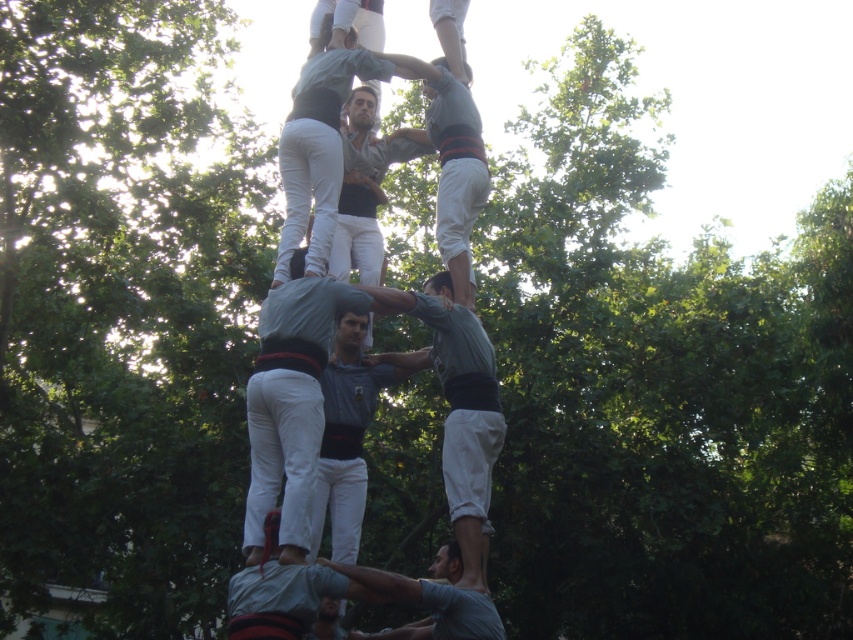
Question: Observing the image, what is the correct spatial positioning of matte gray shirt at center in reference to gray cotton shirt at lower center?

Choices:
 (A) left
 (B) right

Answer: (B)

Question: Which point is farther to the camera?

Choices:
 (A) matte gray shirt at center
 (B) gray cotton shirt at lower center

Answer: (A)

Question: In this image, where is matte gray shirt at center located relative to gray cotton shirt at lower center?

Choices:
 (A) right
 (B) left

Answer: (A)

Question: Is matte gray shirt at center above gray cotton shirt at lower center?

Choices:
 (A) yes
 (B) no

Answer: (A)

Question: Which of the following is the closest to the observer?

Choices:
 (A) gray cotton shirt at lower center
 (B) matte gray shirt at center

Answer: (A)